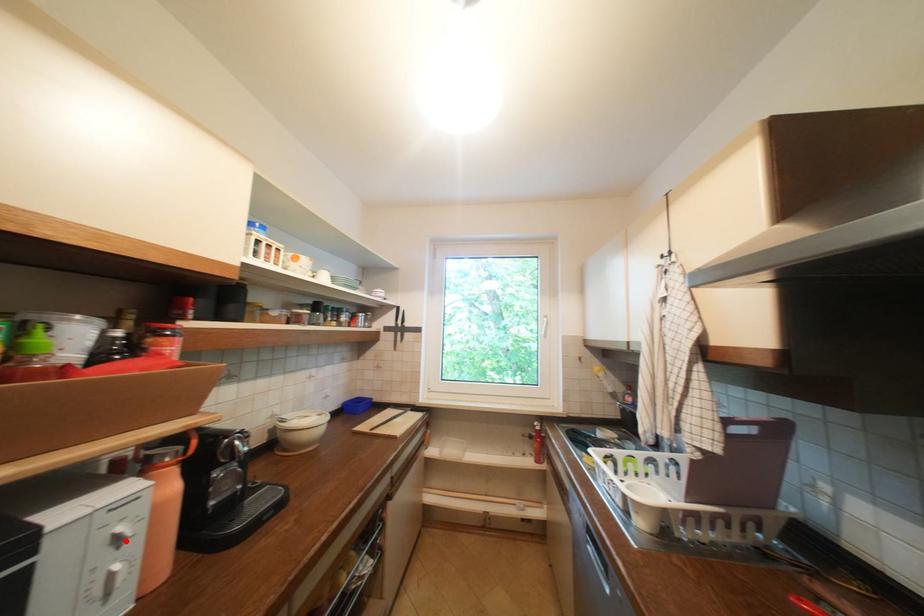
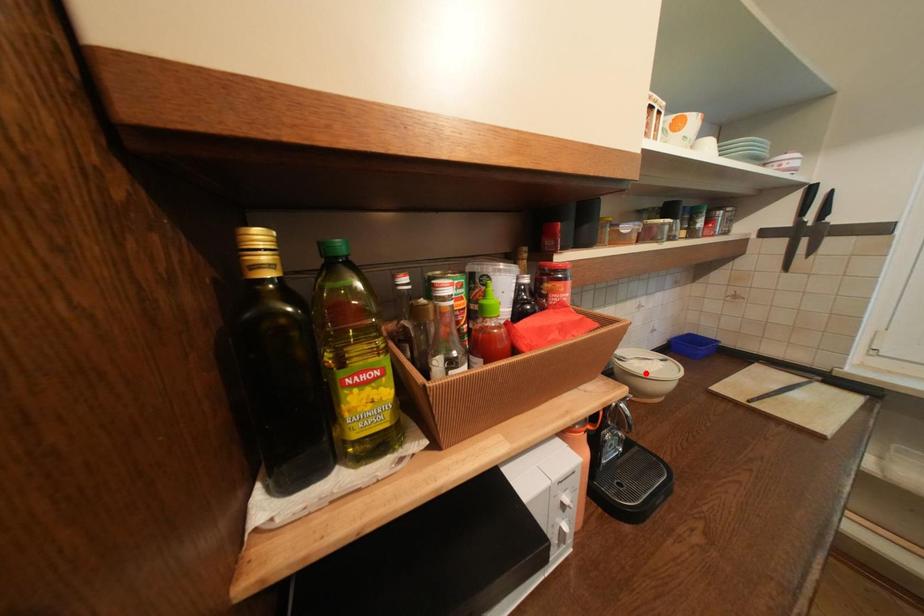
I am providing you with two images of the same scene from different viewpoints. A red point is marked on the first image and another point is marked on the second image. Is the red point in image1 aligned with the point shown in image2?

No